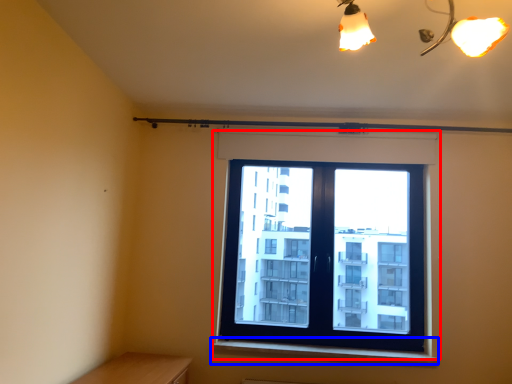
Question: Which object is further to the camera taking this photo, window (highlighted by a red box) or window sill (highlighted by a blue box)?

Choices:
 (A) window
 (B) window sill

Answer: (A)